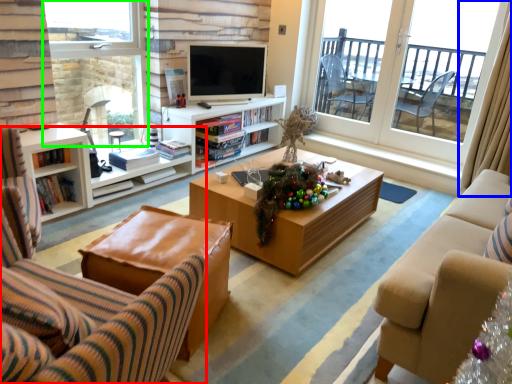
Question: Considering the real-world distances, which object is farthest from chair (highlighted by a red box)? curtain (highlighted by a blue box) or window (highlighted by a green box)?

Choices:
 (A) curtain
 (B) window

Answer: (A)